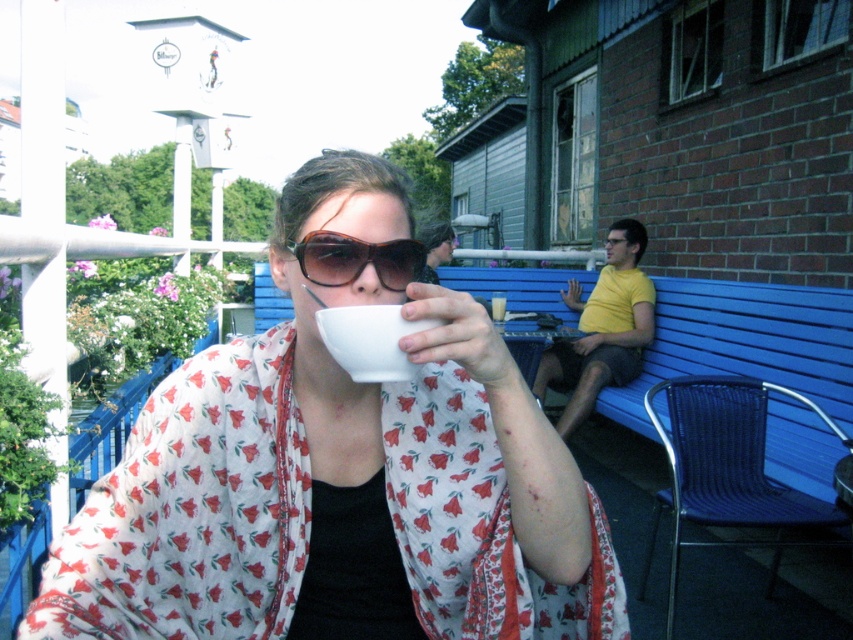
You are a barista at the outdoor patio and need to deliver a drink to the customer. The customer is holding the white glossy mug at center and has the matte black sunglasses at center. Which object should you focus on to ensure the drink is placed correctly?

The white glossy mug at center is in front of the matte black sunglasses at center, so you should focus on placing the drink into the white glossy mug at center to ensure proper delivery.

You are a barista at the outdoor patio and you need to deliver a drink to the customer at the blue wooden bench. You are currently standing at the point marked as point (339, 477). Is the white glossy mug at center located to the left or right of the blue wooden bench?

The white glossy mug at center is located at point (339, 477), which is to the right of the blue wooden bench. Therefore, the white glossy mug at center is to the right of the blue wooden bench.

You are a barista trying to place the matte black sunglasses at center and the white glossy mug at center on a shelf. The shelf has a height limit of 12 inches. Can you safely place both items on the shelf without exceeding the height limit?

The white glossy mug at center is much taller than the matte black sunglasses at center. Since the shelf has a height limit of 12 inches, you can safely place both items on the shelf as long as the mug doesn answer exceed the height limit individually. However, if the mug alone is taller than 12 inches, it cannot be placed. The description does not provide exact measurements, so we cannot confirm.